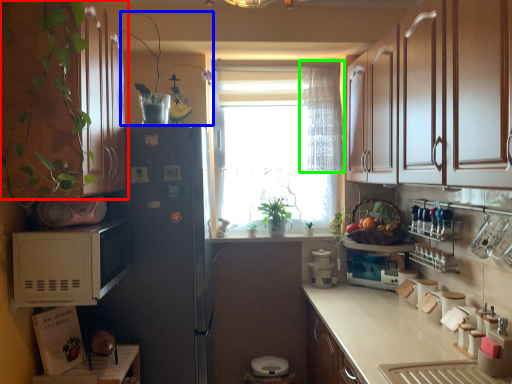
Question: Estimate the real-world distances between objects in this image. Which object is farther from cabinetry (highlighted by a red box), plant (highlighted by a blue box) or curtain (highlighted by a green box)?

Choices:
 (A) plant
 (B) curtain

Answer: (B)